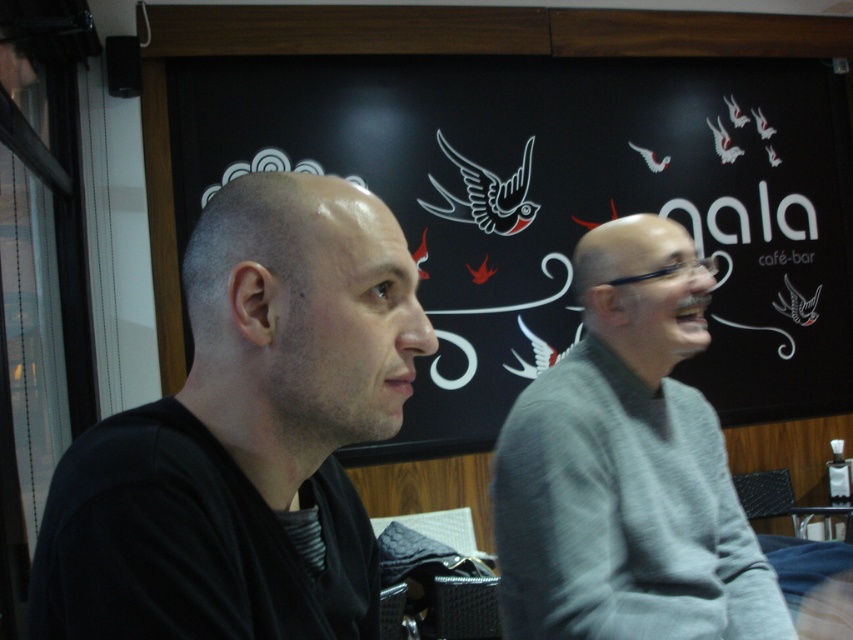
Does black matte/blackboard at upper center appear on the right side of black plastic table at lower right?

No, black matte/blackboard at upper center is not to the right of black plastic table at lower right.

Who is shorter, black matte/blackboard at upper center or black plastic table at lower right?

black plastic table at lower right

Describe the element at coordinates (560, 205) in the screenshot. I see `black matte/blackboard at upper center` at that location.

Identify the location of black matte/blackboard at upper center. (560, 205).

Does gray wool sweater at right have a greater width compared to black plastic table at lower right?

Correct, the width of gray wool sweater at right exceeds that of black plastic table at lower right.

Between point (589, 531) and point (828, 506), which one is positioned behind?

The point (828, 506) is more distant.

Where is `gray wool sweater at right`? gray wool sweater at right is located at coordinates (627, 467).

How much distance is there between black matte shirt at left and black plastic table at lower right?

black matte shirt at left is 3.44 meters from black plastic table at lower right.

Does black matte shirt at left appear over black plastic table at lower right?

Yes, black matte shirt at left is above black plastic table at lower right.

This screenshot has width=853, height=640. I want to click on black matte shirt at left, so click(x=245, y=435).

Find the location of a particular element. The height and width of the screenshot is (640, 853). black matte shirt at left is located at coordinates (245, 435).